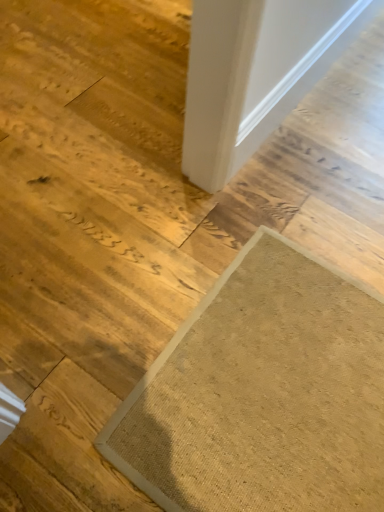
Identify the location of vacant space behind textured beige mat at lower right. (286, 201).